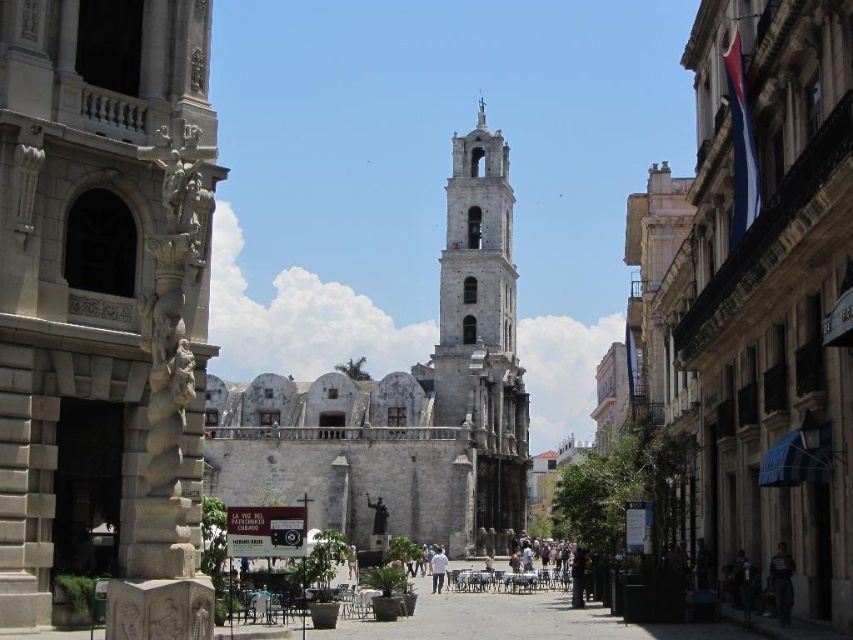
You are a tourist standing in front of the stone church at center and the dark gray fabric jacket at lower right. Which object is taller?

The stone church at center is taller than the dark gray fabric jacket at lower right.

Consider the image. You are a tourist in Havana, Cuba, and you see the Cuban flag on the right. There is a point marked at coordinates (x=88, y=276). What does this point indicate?

The point at coordinates (x=88, y=276) marks the location of the stone church at center.